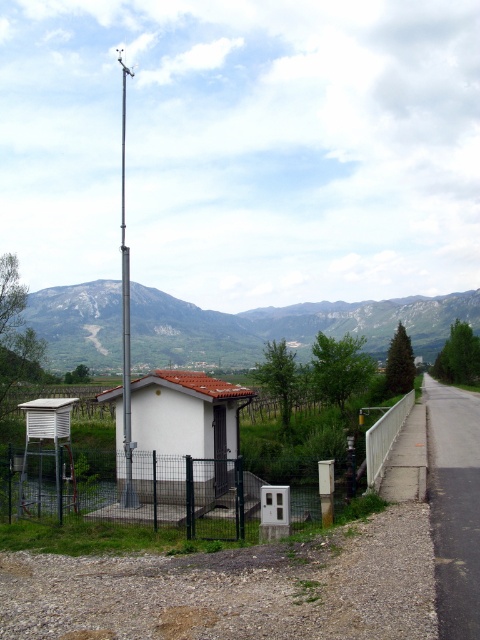
You are a hiker standing at the base of the gray rocky mountain at center and looking towards the silver metallic pole at center. Which object is taller according to the scene description?

The silver metallic pole at center is taller than the gray rocky mountain at center.

You are standing on the paved road near the small white building with a red roof. You want to reach the point marked at coordinates (183,310). Considering the terrain, which direction should you walk from your current position to reach that point?

The point marked at coordinates (183,310) is 413.83 feet away from the viewer. Since the terrain includes grass, shrubs, and trees around the building, you should walk towards the direction of the smaller white box structure located to the left of the building to reach the point.